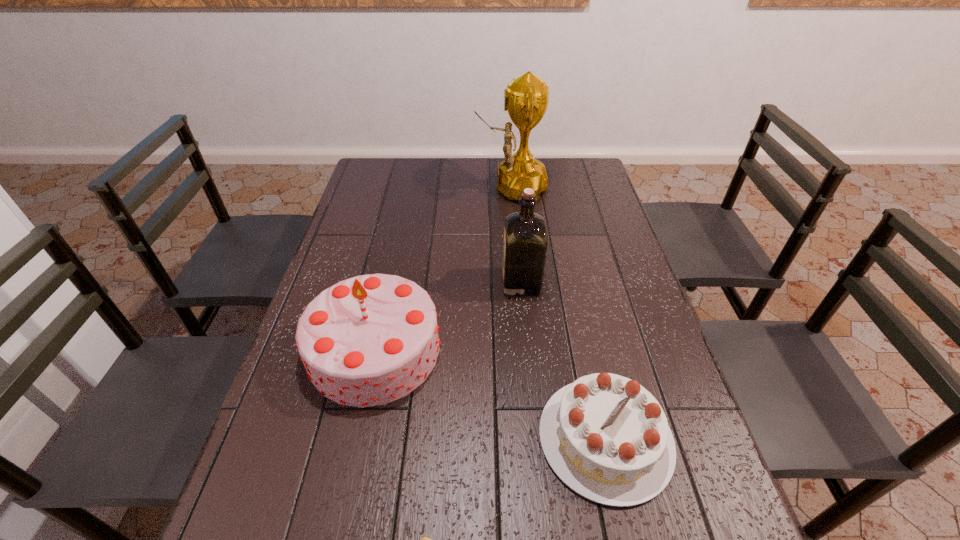
Where is `free region at the left edge`? Image resolution: width=960 pixels, height=540 pixels. free region at the left edge is located at coordinates (372, 223).

The width and height of the screenshot is (960, 540). Find the location of `free space at the right edge`. free space at the right edge is located at coordinates (571, 202).

In the image, there is a desktop. Identify the location of vacant space at the far right corner. (558, 176).

What are the coordinates of `free point between the right birthday cake and the farthest object` in the screenshot? It's located at (558, 313).

Identify the location of free space between the second shortest object and the fourth shortest object. (564, 360).

This screenshot has height=540, width=960. Identify the location of empty space between the award and the fourth tallest object. (558, 313).

This screenshot has width=960, height=540. I want to click on empty space between the taller birthday cake and the fourth tallest object, so click(x=491, y=394).

At what (x,y) coordinates should I click in order to perform the action: click on free space between the third tallest object and the farthest object. Please return your answer as a coordinate pair (x, y). The image size is (960, 540). Looking at the image, I should click on (443, 268).

You are a GUI agent. You are given a task and a screenshot of the screen. Output one action in this format:
    pyautogui.click(x=<x>, y=<y>)
    Task: Click on the object that is the third closest to the liquor
    The height and width of the screenshot is (540, 960).
    Given the screenshot: What is the action you would take?
    coord(526,98)

Locate which object is the second closest to the second farthest object. Please provide its 2D coordinates. Your answer should be formatted as a tuple, i.e. [(x, y)], where the tuple contains the x and y coordinates of a point satisfying the conditions above.

[(605, 436)]